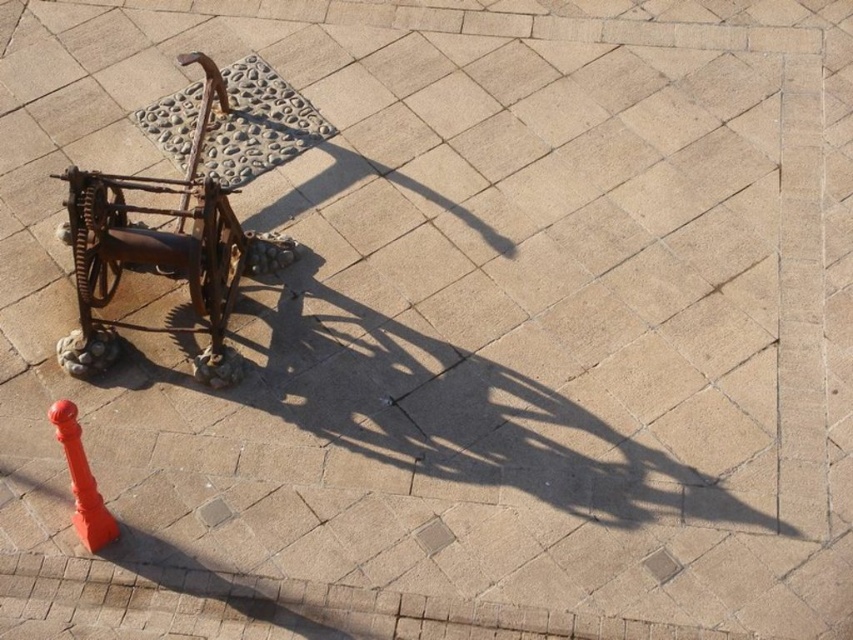
Question: Can you confirm if rusty metal baby carriage at center is positioned to the right of orange matte traffic cone at lower left?

Choices:
 (A) yes
 (B) no

Answer: (A)

Question: Does rusty metal baby carriage at center appear on the left side of orange matte traffic cone at lower left?

Choices:
 (A) yes
 (B) no

Answer: (B)

Question: Is rusty metal baby carriage at center closer to camera compared to orange matte traffic cone at lower left?

Choices:
 (A) yes
 (B) no

Answer: (B)